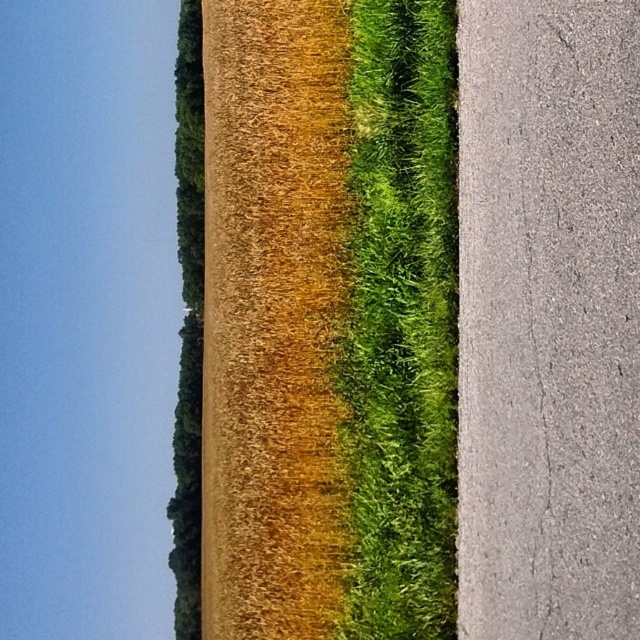
Question: Considering the relative positions of golden textured wheat at center and green leafy tree at upper center in the image provided, where is golden textured wheat at center located with respect to green leafy tree at upper center?

Choices:
 (A) left
 (B) right

Answer: (B)

Question: Does golden textured wheat at center have a greater width compared to green leafy tree at upper center?

Choices:
 (A) no
 (B) yes

Answer: (A)

Question: Is green fuzzy grass at center to the right of green leafy tree at upper center from the viewer's perspective?

Choices:
 (A) yes
 (B) no

Answer: (A)

Question: Based on their relative distances, which object is farther from the green fuzzy grass at center?

Choices:
 (A) green leafy tree at upper center
 (B) golden textured wheat at center

Answer: (A)

Question: Which of the following is the farthest from the observer?

Choices:
 (A) (435, 458)
 (B) (195, 122)

Answer: (B)

Question: Which object is closer to the camera taking this photo?

Choices:
 (A) golden textured wheat at center
 (B) green fuzzy grass at center

Answer: (B)